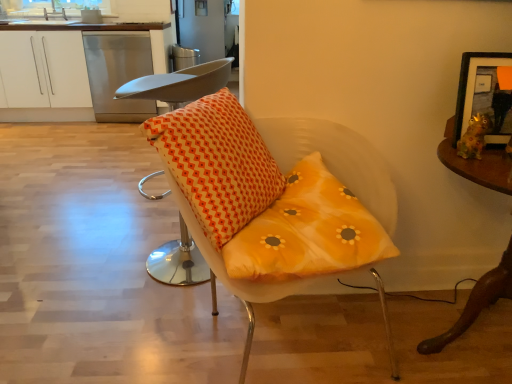
Describe the element at coordinates (476, 302) in the screenshot. I see `wooden table at right` at that location.

Based on the photo, what is the approximate width of white matte cabinet at upper left?

The width of white matte cabinet at upper left is 24.82 inches.

Locate an element on the screen. The image size is (512, 384). orange fabric cushion at center, positioned as the second chair in right-to-left order is located at coordinates (179, 84).

The image size is (512, 384). I want to click on wooden table at right, so click(476, 302).

Is point (160, 120) closer or farther from the camera than point (195, 139)?

Point (160, 120) appears to be closer to the viewer than point (195, 139).

Looking at this image, is orange printed cushion at center smaller than yellow fabric cushion at center, which is counted as the second chair, starting from the left?

Indeed, orange printed cushion at center has a smaller size compared to yellow fabric cushion at center, which is counted as the second chair, starting from the left.

Which object is thinner, orange printed cushion at center or yellow fabric cushion at center, which is counted as the second chair, starting from the left?

With smaller width is orange printed cushion at center.

Is stainless steel dishwasher at upper left facing away from wooden framed picture at upper right?

That's not correct — stainless steel dishwasher at upper left is not looking away from wooden framed picture at upper right.

Considering the sizes of stainless steel dishwasher at upper left and wooden framed picture at upper right in the image, is stainless steel dishwasher at upper left taller or shorter than wooden framed picture at upper right?

Considering their sizes, stainless steel dishwasher at upper left has more height than wooden framed picture at upper right.

From a real-world perspective, which object rests below the other?

stainless steel dishwasher at upper left is physically lower.

In the image, is stainless steel dishwasher at upper left positioned in front of or behind wooden framed picture at upper right?

In the image, stainless steel dishwasher at upper left appears behind wooden framed picture at upper right.

Between wooden framed picture at upper right and orange fabric cushion at center, arranged as the 1th chair when viewed from the left, which one has larger size?

orange fabric cushion at center, arranged as the 1th chair when viewed from the left, is bigger.

From a real-world perspective, which is physically below, wooden framed picture at upper right or orange fabric cushion at center, positioned as the second chair in right-to-left order?

In real-world perspective, orange fabric cushion at center, positioned as the second chair in right-to-left order, is lower.

Is wooden framed picture at upper right positioned in front of orange fabric cushion at center, positioned as the second chair in right-to-left order?

Yes, it is.

Is wooden framed picture at upper right outside of orange fabric cushion at center, positioned as the second chair in right-to-left order?

Absolutely, wooden framed picture at upper right is external to orange fabric cushion at center, positioned as the second chair in right-to-left order.

Is orange fabric cushion at center, positioned as the second chair in right-to-left order, next to wooden framed picture at upper right?

No, orange fabric cushion at center, positioned as the second chair in right-to-left order, is not beside wooden framed picture at upper right.

The image size is (512, 384). Identify the location of chair behind the wooden framed picture at upper right. (179, 84).

From the image's perspective, who appears lower, orange fabric cushion at center, arranged as the 1th chair when viewed from the left, or wooden framed picture at upper right?

From the image's view, orange fabric cushion at center, arranged as the 1th chair when viewed from the left, is below.

How far apart are orange fabric cushion at center, positioned as the second chair in right-to-left order, and wooden table at right?

orange fabric cushion at center, positioned as the second chair in right-to-left order, is 1.09 meters away from wooden table at right.

Is orange fabric cushion at center, arranged as the 1th chair when viewed from the left, in contact with wooden table at right?

No, orange fabric cushion at center, arranged as the 1th chair when viewed from the left, is not beside wooden table at right.

Would you say wooden table at right is part of orange fabric cushion at center, arranged as the 1th chair when viewed from the left,'s contents?

Definitely not — wooden table at right is not inside orange fabric cushion at center, arranged as the 1th chair when viewed from the left.

Which is in front, point (188, 256) or point (473, 303)?

The point (473, 303) is in front.

Would you say wooden table at right is a long distance from orange fabric cushion at center, arranged as the 1th chair when viewed from the left?

Yes, wooden table at right and orange fabric cushion at center, arranged as the 1th chair when viewed from the left, are located far from each other.

Is orange fabric cushion at center, arranged as the 1th chair when viewed from the left, surrounded by wooden table at right?

No, orange fabric cushion at center, arranged as the 1th chair when viewed from the left, is not inside wooden table at right.

Is wooden table at right turned away from orange fabric cushion at center, positioned as the second chair in right-to-left order?

No, wooden table at right is not facing the opposite direction of orange fabric cushion at center, positioned as the second chair in right-to-left order.

Can you tell me how much yellow fabric cushion at center, which is counted as the second chair, starting from the left, and white matte cabinet at upper left differ in facing direction?

The angle between the facing direction of yellow fabric cushion at center, which is counted as the second chair, starting from the left, and the facing direction of white matte cabinet at upper left is 12.7 degrees.

Is yellow fabric cushion at center, placed as the 1th chair when sorted from right to left, inside the boundaries of white matte cabinet at upper left, or outside?

yellow fabric cushion at center, placed as the 1th chair when sorted from right to left, is spatially situated outside white matte cabinet at upper left.

Based on the photo, considering the relative positions of yellow fabric cushion at center, placed as the 1th chair when sorted from right to left, and white matte cabinet at upper left in the image provided, is yellow fabric cushion at center, placed as the 1th chair when sorted from right to left, to the left or to the right of white matte cabinet at upper left?

Clearly, yellow fabric cushion at center, placed as the 1th chair when sorted from right to left, is on the right of white matte cabinet at upper left in the image.

From the image's perspective, which object appears higher, yellow fabric cushion at center, which is counted as the second chair, starting from the left, or white matte cabinet at upper left?

white matte cabinet at upper left is shown above in the image.

Where is `chair in front of the orange printed cushion at center`? The height and width of the screenshot is (384, 512). chair in front of the orange printed cushion at center is located at coordinates (258, 205).

Where is `picture frame on the right side of stainless steel dishwasher at upper left`? Image resolution: width=512 pixels, height=384 pixels. picture frame on the right side of stainless steel dishwasher at upper left is located at coordinates (482, 95).

Based on their spatial positions, is white matte cabinet at upper left or wooden framed picture at upper right further from orange fabric cushion at center, arranged as the 1th chair when viewed from the left?

white matte cabinet at upper left lies further to orange fabric cushion at center, arranged as the 1th chair when viewed from the left, than the other object.

Estimate the real-world distances between objects in this image. Which object is further from orange fabric cushion at center, positioned as the second chair in right-to-left order, white matte cabinet at upper left or stainless steel dishwasher at upper left?

white matte cabinet at upper left is positioned further to the anchor orange fabric cushion at center, positioned as the second chair in right-to-left order.

Estimate the real-world distances between objects in this image. Which object is further from orange fabric cushion at center, positioned as the second chair in right-to-left order, yellow fabric cushion at center, which is counted as the second chair, starting from the left, or orange printed cushion at center?

Among the two, yellow fabric cushion at center, which is counted as the second chair, starting from the left, is located further to orange fabric cushion at center, positioned as the second chair in right-to-left order.

When comparing their distances from white matte cabinet at upper left, does orange printed cushion at center or orange fabric cushion at center, positioned as the second chair in right-to-left order, seem closer?

orange fabric cushion at center, positioned as the second chair in right-to-left order.

When comparing their distances from orange fabric cushion at center, arranged as the 1th chair when viewed from the left, does orange printed cushion at center or white matte cabinet at upper left seem closer?

Among the two, orange printed cushion at center is located nearer to orange fabric cushion at center, arranged as the 1th chair when viewed from the left.

Based on their spatial positions, is wooden table at right or yellow fabric cushion at center, placed as the 1th chair when sorted from right to left, closer to wooden framed picture at upper right?

wooden table at right lies closer to wooden framed picture at upper right than the other object.

Looking at the image, which one is located further to orange printed cushion at center, wooden table at right or stainless steel dishwasher at upper left?

stainless steel dishwasher at upper left is positioned further to the anchor orange printed cushion at center.

Considering their positions, is white matte cabinet at upper left positioned closer to wooden framed picture at upper right than orange fabric cushion at center, positioned as the second chair in right-to-left order?

orange fabric cushion at center, positioned as the second chair in right-to-left order, is closer to wooden framed picture at upper right.

Image resolution: width=512 pixels, height=384 pixels. I want to click on throw pillow positioned between yellow fabric cushion at center, placed as the 1th chair when sorted from right to left, and white matte cabinet at upper left from near to far, so click(x=217, y=163).

Find the location of a particular element. picture frame between yellow fabric cushion at center, placed as the 1th chair when sorted from right to left, and stainless steel dishwasher at upper left from front to back is located at coordinates (482, 95).

The width and height of the screenshot is (512, 384). What are the coordinates of `chair positioned between orange printed cushion at center and stainless steel dishwasher at upper left from near to far` in the screenshot? It's located at (179, 84).

Where is `table between yellow fabric cushion at center, which is counted as the second chair, starting from the left, and white matte cabinet at upper left, along the z-axis`? table between yellow fabric cushion at center, which is counted as the second chair, starting from the left, and white matte cabinet at upper left, along the z-axis is located at coordinates (476, 302).